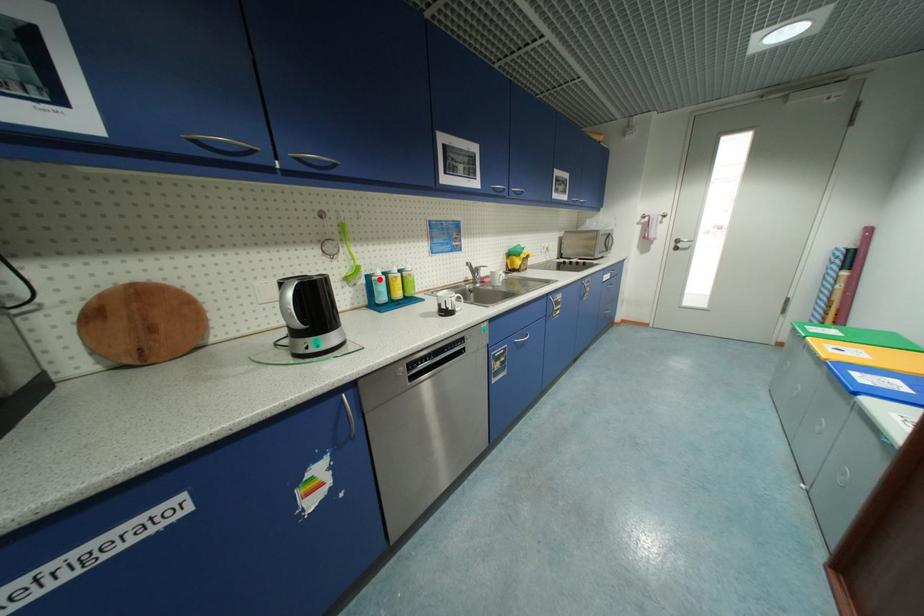
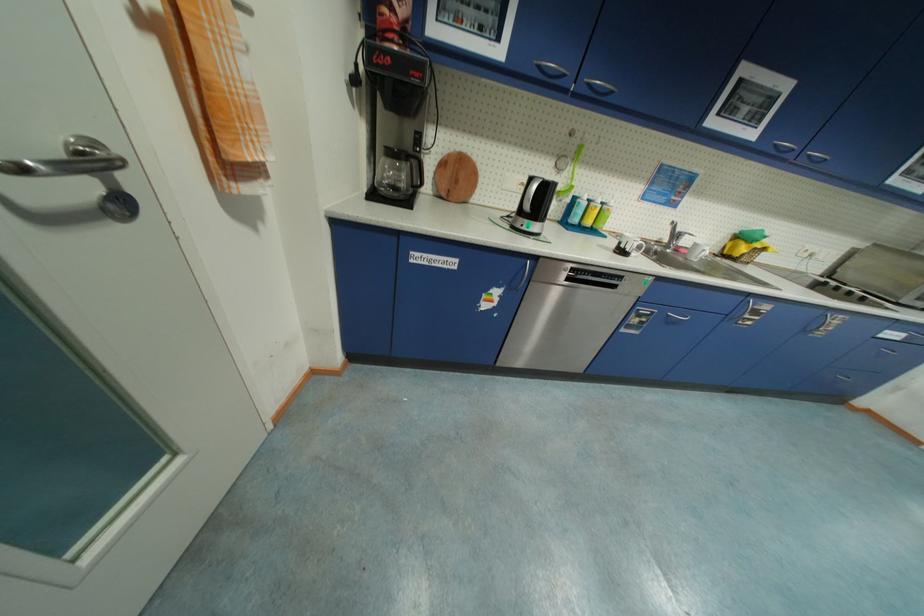
In the second image, find the point that corresponds to the highlighted location in the first image.

(584, 201)